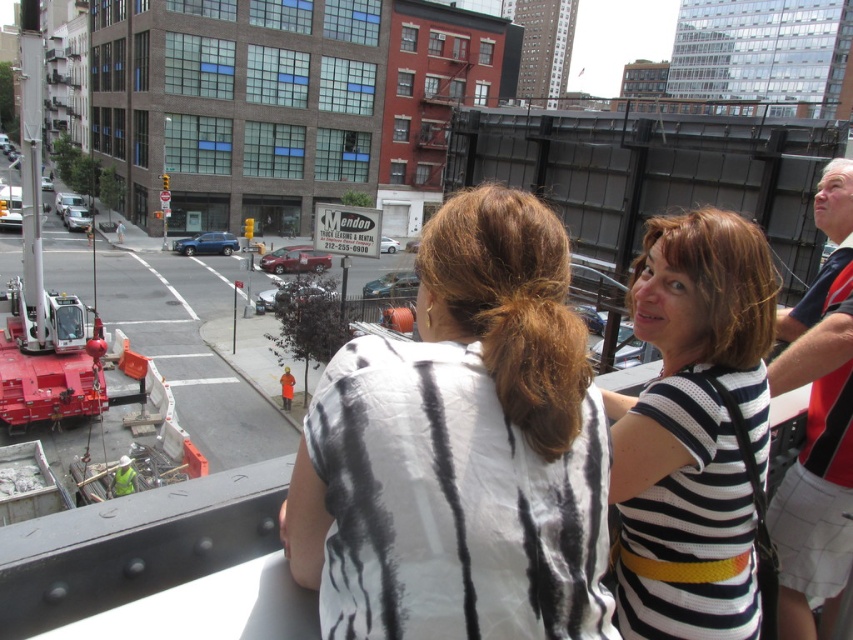
Question: Which point appears farthest from the camera in this image?

Choices:
 (A) (833, 412)
 (B) (486, 205)
 (C) (708, 605)

Answer: (A)

Question: Observing the image, what is the correct spatial positioning of white striped shirt at center in reference to striped cotton shirt at center?

Choices:
 (A) left
 (B) right

Answer: (A)

Question: Is white striped shirt at center positioned at the back of white and red polo shirt at upper right?

Choices:
 (A) yes
 (B) no

Answer: (B)

Question: Which object appears farthest from the camera in this image?

Choices:
 (A) striped cotton shirt at center
 (B) white and red polo shirt at upper right
 (C) white striped shirt at center

Answer: (B)

Question: Among these points, which one is nearest to the camera?

Choices:
 (A) (844, 579)
 (B) (753, 280)
 (C) (532, 600)

Answer: (C)

Question: From the image, what is the correct spatial relationship of white striped shirt at center in relation to striped cotton shirt at center?

Choices:
 (A) left
 (B) right

Answer: (A)